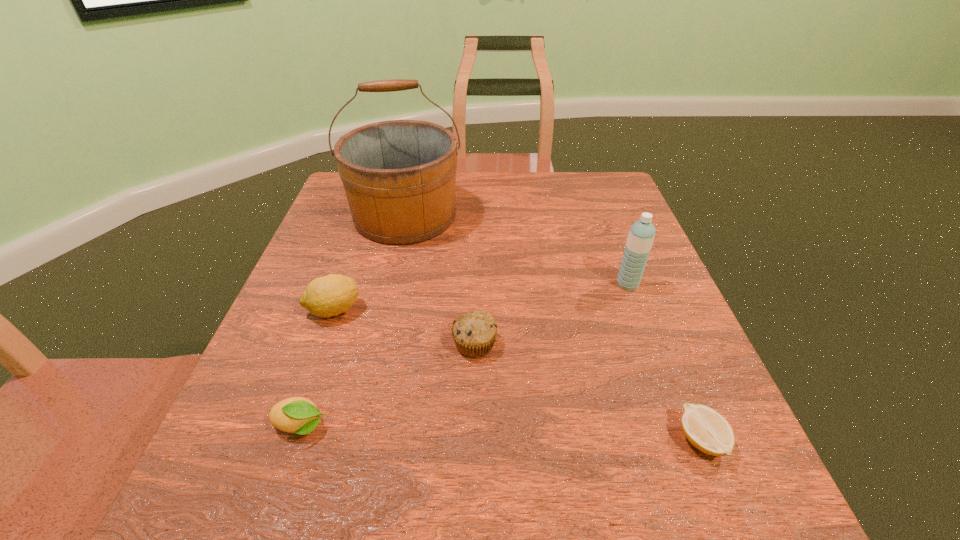
Find the location of a particular element. free space between the second tallest object and the third nearest object is located at coordinates (551, 314).

The width and height of the screenshot is (960, 540). Identify the location of empty location between the muffin and the shortest lemon. (588, 392).

At what (x,y) coordinates should I click in order to perform the action: click on free space between the farthest object and the rightmost lemon. Please return your answer as a coordinate pair (x, y). The image size is (960, 540). Looking at the image, I should click on tap(553, 328).

Find the location of a particular element. free space between the farthest object and the fourth nearest object is located at coordinates (370, 262).

What are the coordinates of `unoccupied position between the fifth tallest object and the water bottle` in the screenshot? It's located at coord(465,355).

You are a GUI agent. You are given a task and a screenshot of the screen. Output one action in this format:
    pyautogui.click(x=<x>, y=<y>)
    Task: Click on the free spot between the muffin and the second tallest lemon
    This screenshot has height=540, width=960.
    Given the screenshot: What is the action you would take?
    pyautogui.click(x=388, y=385)

Image resolution: width=960 pixels, height=540 pixels. I want to click on empty space between the farthest lemon and the farthest object, so tap(370, 262).

Locate which object is the fourth closest to the second tallest lemon. Please provide its 2D coordinates. Your answer should be formatted as a tuple, i.e. [(x, y)], where the tuple contains the x and y coordinates of a point satisfying the conditions above.

[(707, 430)]

Identify which object is located as the fifth nearest to the bucket. Please provide its 2D coordinates. Your answer should be formatted as a tuple, i.e. [(x, y)], where the tuple contains the x and y coordinates of a point satisfying the conditions above.

[(707, 430)]

Identify which lemon is the closest to the fifth nearest object. Please provide its 2D coordinates. Your answer should be formatted as a tuple, i.e. [(x, y)], where the tuple contains the x and y coordinates of a point satisfying the conditions above.

[(707, 430)]